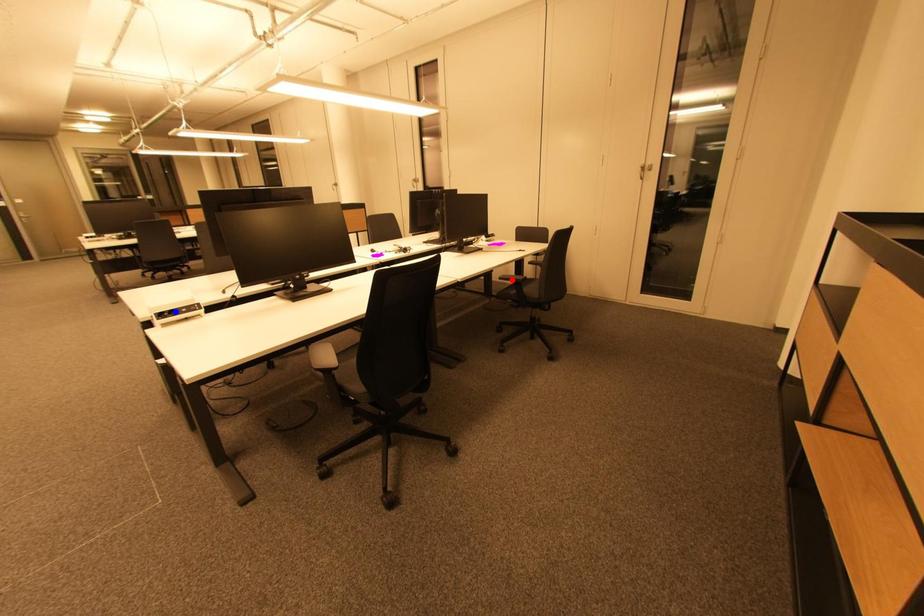
Question: Two points are marked on the image. Which point is closer to the camera?

Choices:
 (A) Blue point is closer.
 (B) Red point is closer.

Answer: (A)